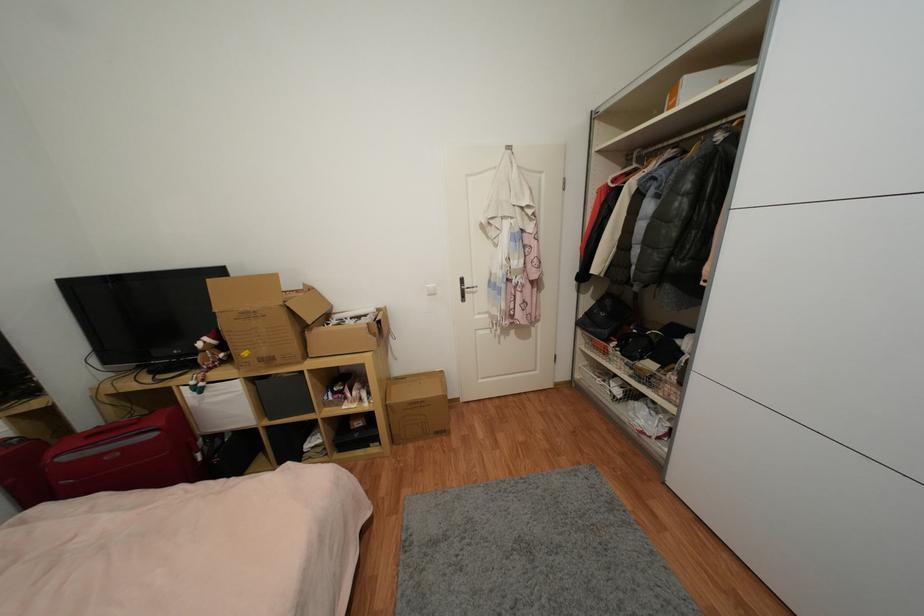
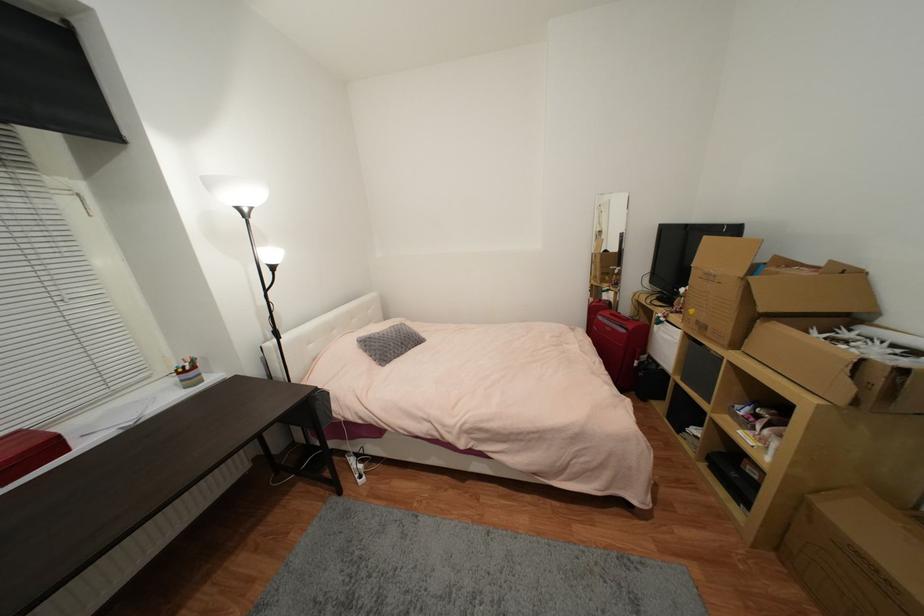
Find the pixel in the second image that matches the point at 377,342 in the first image.

(852, 390)